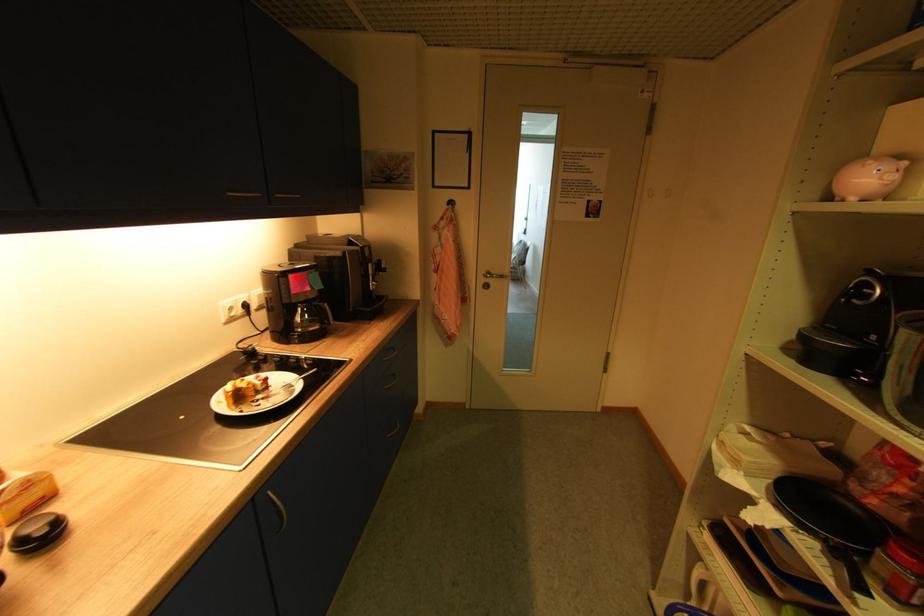
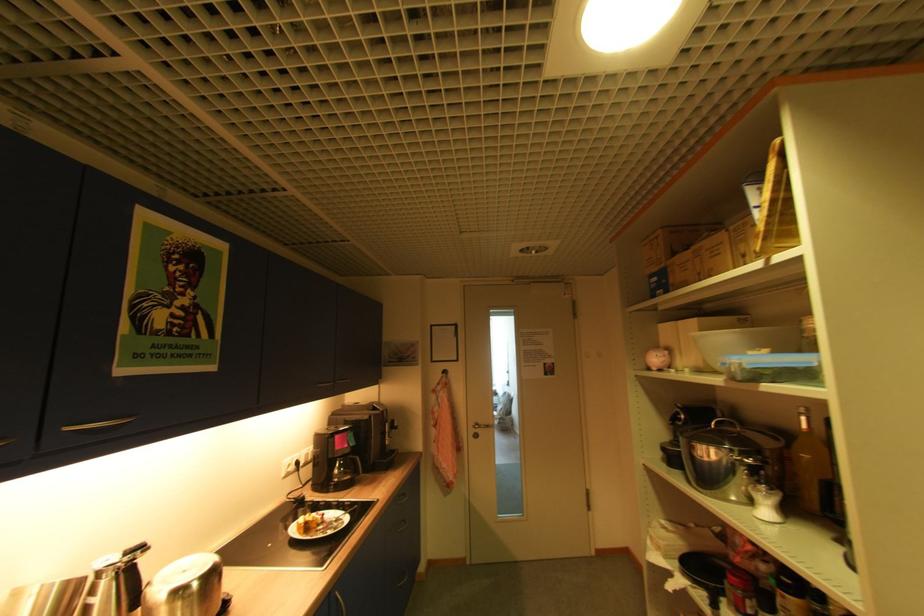
The point at the highlighted location is marked in the first image. Where is the corresponding point in the second image?

(343, 437)